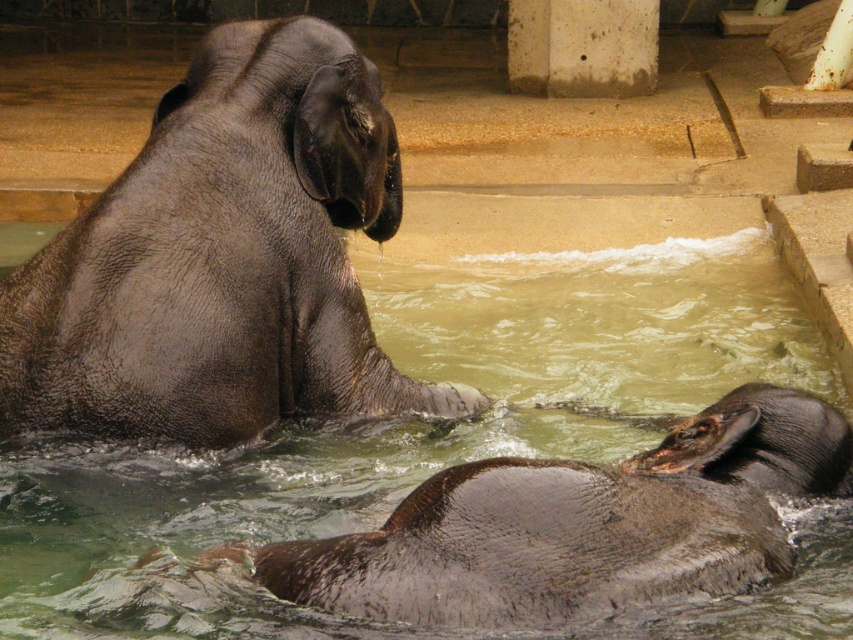
Does clear water at elephant center have a greater width compared to shiny brown elephant at lower center?

Yes.

Does point (498, 444) come closer to viewer compared to point (480, 484)?

No.

The image size is (853, 640). Identify the location of clear water at elephant center. (401, 429).

Looking at this image, between clear water at elephant center and gray matte elephant at upper left, which one has more height?

With more height is gray matte elephant at upper left.

Is clear water at elephant center shorter than gray matte elephant at upper left?

Yes, clear water at elephant center is shorter than gray matte elephant at upper left.

Is point (676, 624) closer to viewer compared to point (221, 138)?

Yes.

Find the location of `clear water at elephant center`. clear water at elephant center is located at coordinates (401, 429).

Who is lower down, gray matte elephant at upper left or shiny brown elephant at lower center?

shiny brown elephant at lower center is below.

Can you confirm if gray matte elephant at upper left is positioned to the right of shiny brown elephant at lower center?

No, gray matte elephant at upper left is not to the right of shiny brown elephant at lower center.

Between point (57, 349) and point (819, 420), which one is positioned behind?

The point (57, 349) is behind.

This screenshot has width=853, height=640. In order to click on gray matte elephant at upper left in this screenshot , I will do `click(223, 259)`.